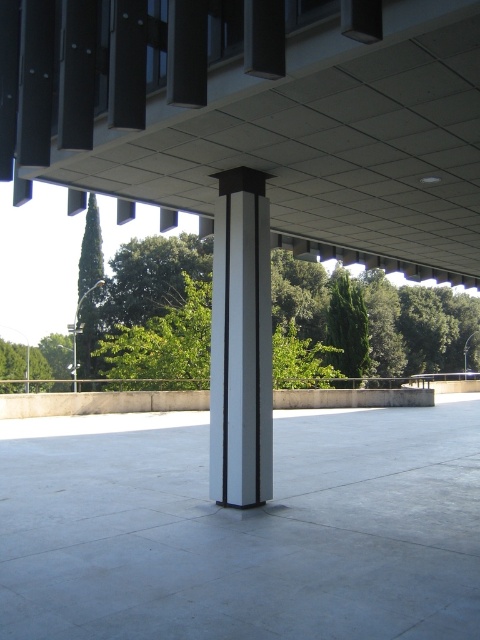
Between metallic gray column at center and green leafy tree at left, which one has less height?

With less height is metallic gray column at center.

Does metallic gray column at center lie behind green leafy tree at left?

That is False.

Locate an element on the screen. metallic gray column at center is located at coordinates (240, 342).

Is point (229, 97) closer to viewer compared to point (179, 502)?

Yes, it is in front of point (179, 502).

Does point (462, 92) come in front of point (47, 502)?

Yes, it is.

Identify the location of white glossy column at center. The height and width of the screenshot is (640, 480). (262, 116).

Is white glossy column at center below green leafy tree at left?

Incorrect, white glossy column at center is not positioned below green leafy tree at left.

Is point (287, 230) in front of point (79, 320)?

Yes, it is in front of point (79, 320).

I want to click on white glossy column at center, so click(x=262, y=116).